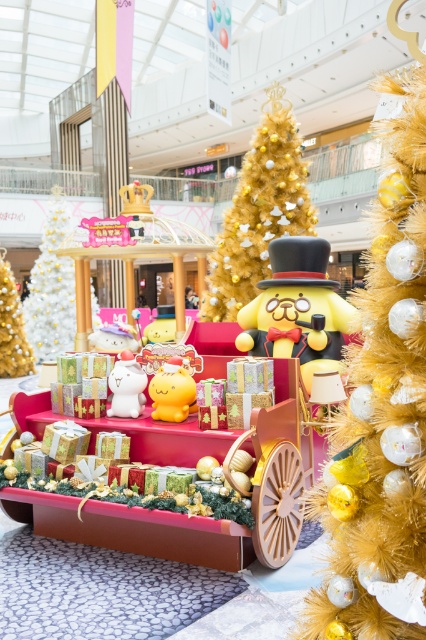
You are a delivery person who needs to place a new gift box on the widest object between the yellow matte bear at center and the white matte christmas tree at center. Which object should you choose?

The white matte christmas tree at center is wider than the yellow matte bear at center, so you should place the gift box on the white matte christmas tree at center.

In the scene shown: You are a visitor at the mall and want to take a photo of the yellow matte bear at center and the white matte christmas tree at center. Which one is shorter?

The yellow matte bear at center is shorter than the white matte christmas tree at center.